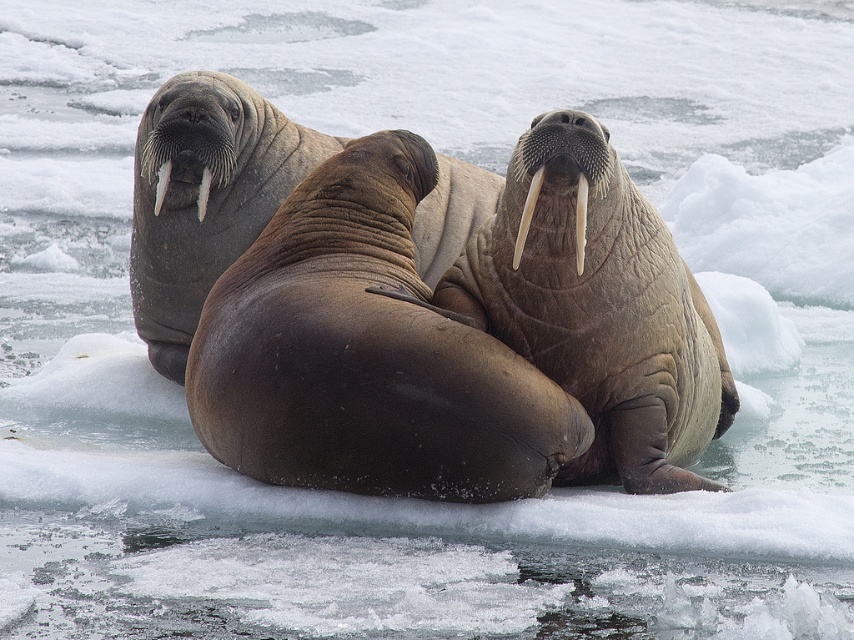
Who is taller, smooth ivory tusk at center or white matte tusk at center?

With more height is smooth ivory tusk at center.

This screenshot has width=854, height=640. What are the coordinates of `smooth ivory tusk at center` in the screenshot? It's located at (527, 212).

Can you confirm if smooth ivory tusk at center is thinner than white ivory tusk at center?

Yes.

Between smooth ivory tusk at center and white ivory tusk at center, which one has less height?

white ivory tusk at center

The height and width of the screenshot is (640, 854). I want to click on smooth ivory tusk at center, so click(x=527, y=212).

Is point (443, 333) behind point (178, 154)?

No, it is not.

Where is `brown matte walrus at center`? Image resolution: width=854 pixels, height=640 pixels. brown matte walrus at center is located at coordinates (366, 353).